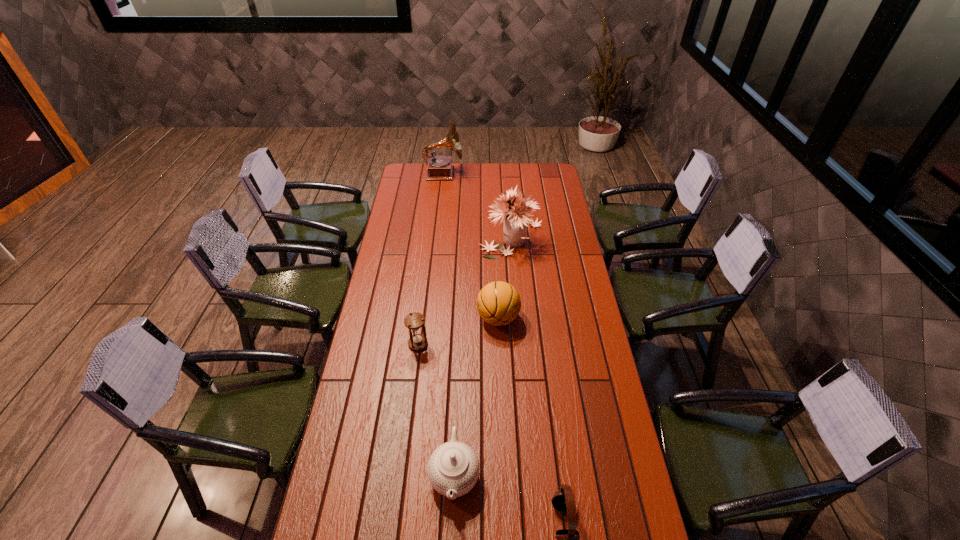
Locate an element on the screen. The width and height of the screenshot is (960, 540). free space located 0.140m on the front of the fourth farthest object is located at coordinates coord(413,384).

This screenshot has height=540, width=960. I want to click on object that is positioned at the far edge, so click(x=439, y=167).

The height and width of the screenshot is (540, 960). Identify the location of object positioned at the left edge. (439, 167).

Image resolution: width=960 pixels, height=540 pixels. I want to click on object located in the right edge section of the desktop, so click(515, 220).

Locate an element on the screen. The width and height of the screenshot is (960, 540). object positioned at the far left corner is located at coordinates (439, 167).

In the image, there is a desktop. Where is `vacant space at the far edge`? This screenshot has height=540, width=960. vacant space at the far edge is located at coordinates (484, 164).

In the image, there is a desktop. Identify the location of blank space at the left edge. This screenshot has width=960, height=540. (381, 297).

I want to click on free space at the right edge of the desktop, so click(604, 455).

This screenshot has height=540, width=960. What are the coordinates of `vacant space that is in between the phonograph_record and the hourglass` in the screenshot? It's located at (431, 259).

Identify the location of free spot between the fourth farthest object and the third farthest object. The height and width of the screenshot is (540, 960). (458, 331).